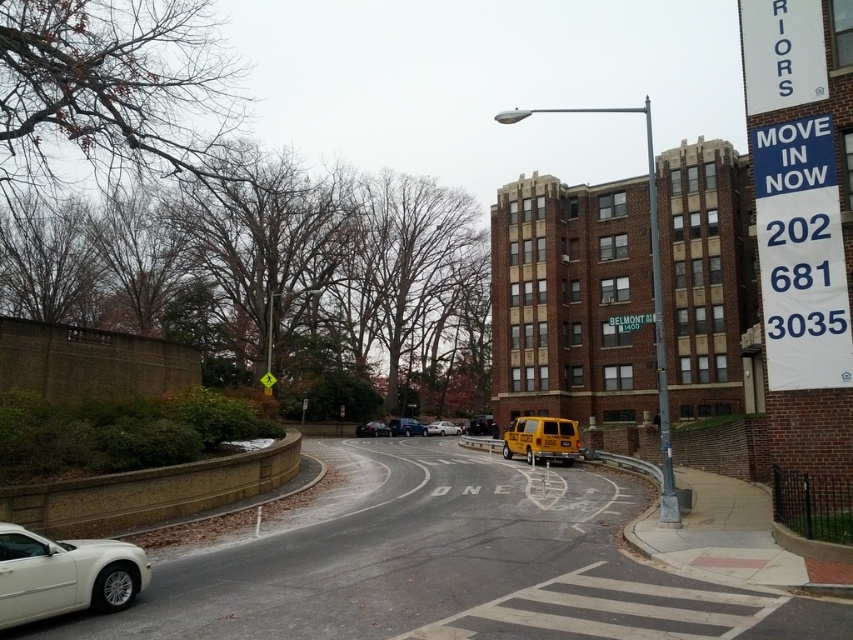
You are driving a delivery van that is 7 meters long and need to make a U turn on the road. The yellow matte school bus at center is parked in the middle of the road. Is there enough space to perform a U turn without moving the school bus?

The yellow matte school bus at center is 28.14 meters away from the viewer. Since the delivery van is only 7 meters long, the distance available should be sufficient to make a U turn without needing to move the school bus.

You are a pedestrian standing on the sidewalk and want to cross the street to reach the multi story brick building. There is a yellow matte school bus at center and a metallic silver car at center in your path. Which vehicle should you avoid first based on their positions?

The yellow matte school bus at center is positioned on the right side of metallic silver car at center. Therefore, the metallic silver car at center is closer to your path, so you should avoid it first before the yellow matte school bus at center.

You are a delivery driver navigating through the urban street scene. Your GPS indicates you need to turn left at the next intersection. However, there is a yellow matte school bus at center blocking your path. Based on the scene description, can you safely make the left turn without crossing the bus?

The yellow matte school bus at center is located at coordinates (x=541, y=440), which places it centrally in the scene. Since the road curves gently to the right and the bus is blocking the center, you can safely make the left turn by staying to the left side of the road, as the bus is positioned centrally and the road curves right, allowing space for the turn without crossing the bus.